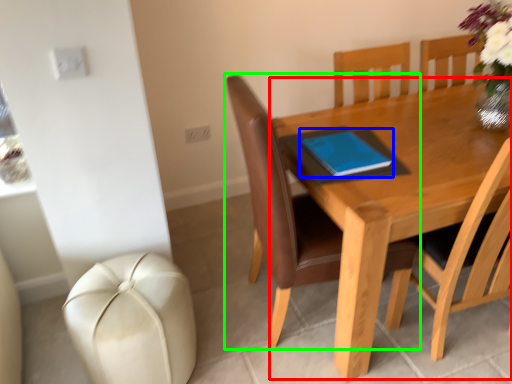
Question: Which is farther away from round table (highlighted by a red box)? notebook (highlighted by a blue box) or chair (highlighted by a green box)?

Choices:
 (A) notebook
 (B) chair

Answer: (B)